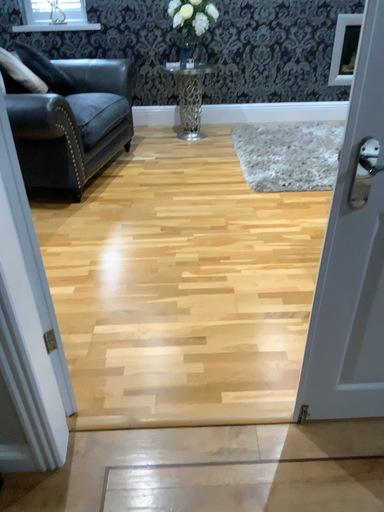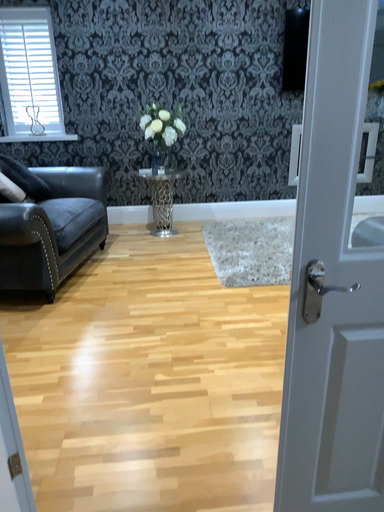
Question: Which way did the camera rotate in the video?

Choices:
 (A) rotated downward
 (B) rotated upward

Answer: (B)